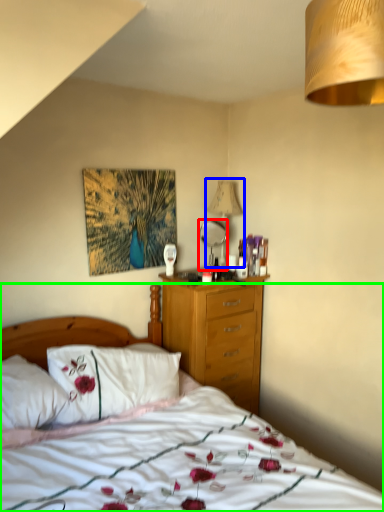
Question: Considering the real-world distances, which object is closest to mirror (highlighted by a red box)? lamp (highlighted by a blue box) or bed (highlighted by a green box).

Choices:
 (A) lamp
 (B) bed

Answer: (A)